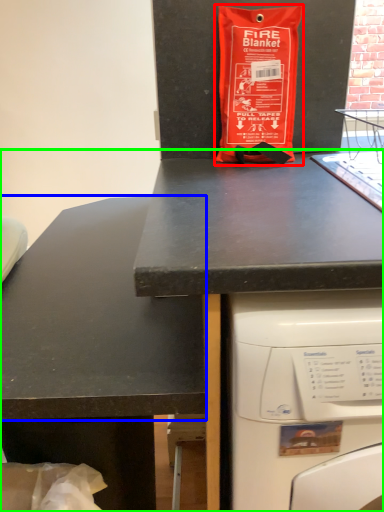
Question: Estimate the real-world distances between objects in this image. Which object is closer to bag (highlighted by a red box), counter top (highlighted by a blue box) or desk (highlighted by a green box)?

Choices:
 (A) counter top
 (B) desk

Answer: (B)